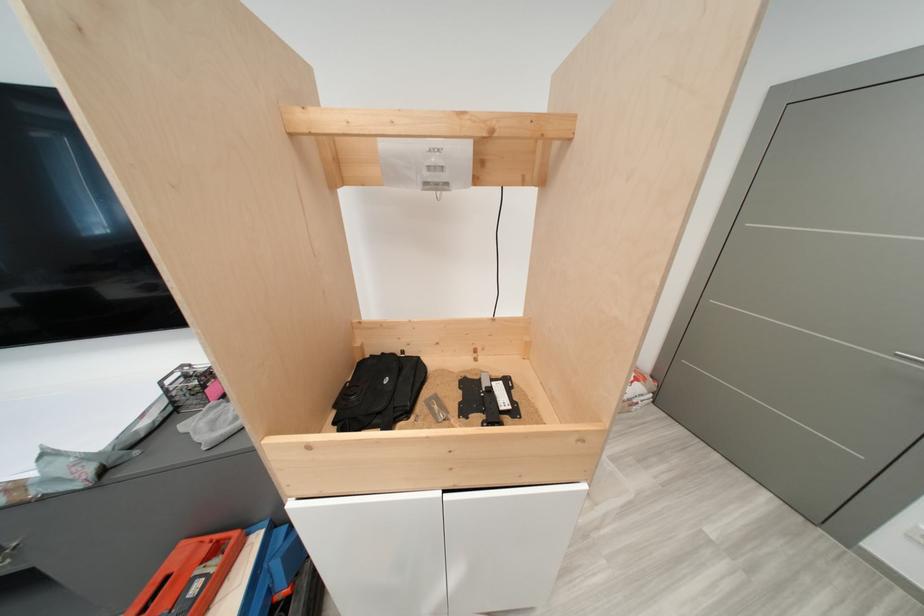
The image size is (924, 616). I want to click on white projector, so click(426, 163).